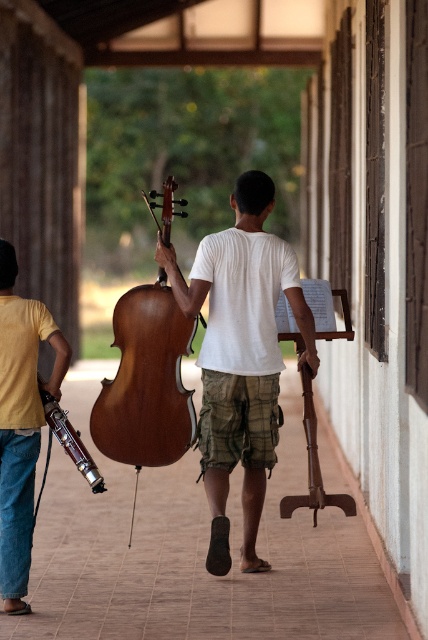
Question: Which object is positioned closest to the wooden violin at center?

Choices:
 (A) wooden cello at center
 (B) shiny brown cello at center
 (C) yellow cotton shirt at left

Answer: (C)

Question: Which point appears closest to the camera in this image?

Choices:
 (A) tap(17, 324)
 (B) tap(208, 266)

Answer: (A)

Question: Does yellow cotton shirt at left appear over wooden violin at center?

Choices:
 (A) yes
 (B) no

Answer: (A)

Question: Is wooden cello at center above wooden violin at center?

Choices:
 (A) yes
 (B) no

Answer: (A)

Question: Does wooden cello at center appear over wooden violin at center?

Choices:
 (A) yes
 (B) no

Answer: (A)

Question: Considering the real-world distances, which object is farthest from the wooden violin at center?

Choices:
 (A) shiny brown cello at center
 (B) wooden cello at center
 (C) yellow cotton shirt at left

Answer: (B)